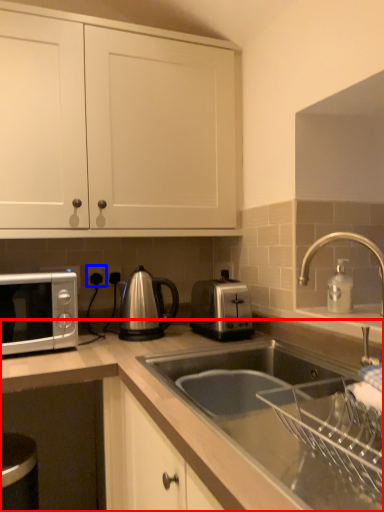
Question: Among these objects, which one is farthest to the camera, countertop (highlighted by a red box) or electric outlet (highlighted by a blue box)?

Choices:
 (A) countertop
 (B) electric outlet

Answer: (B)